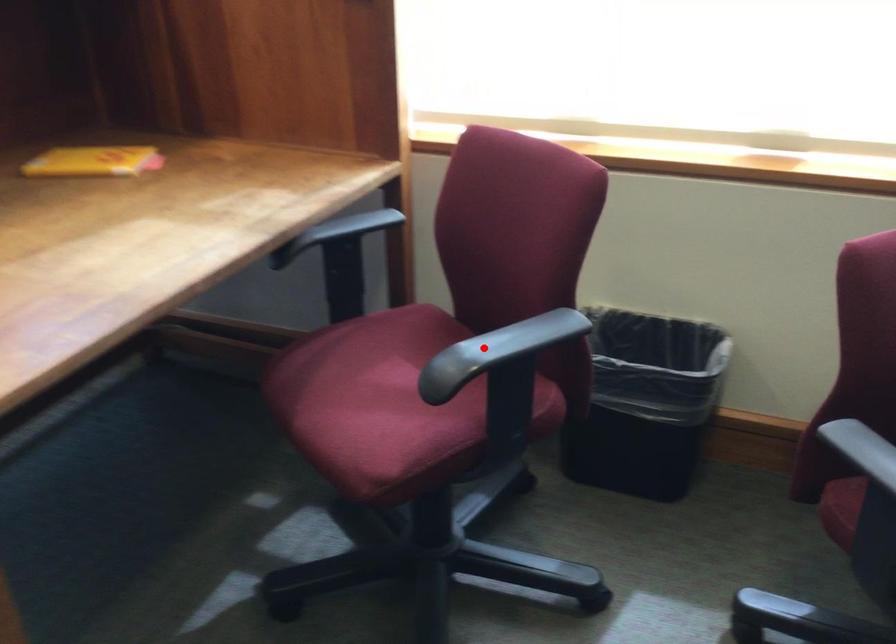
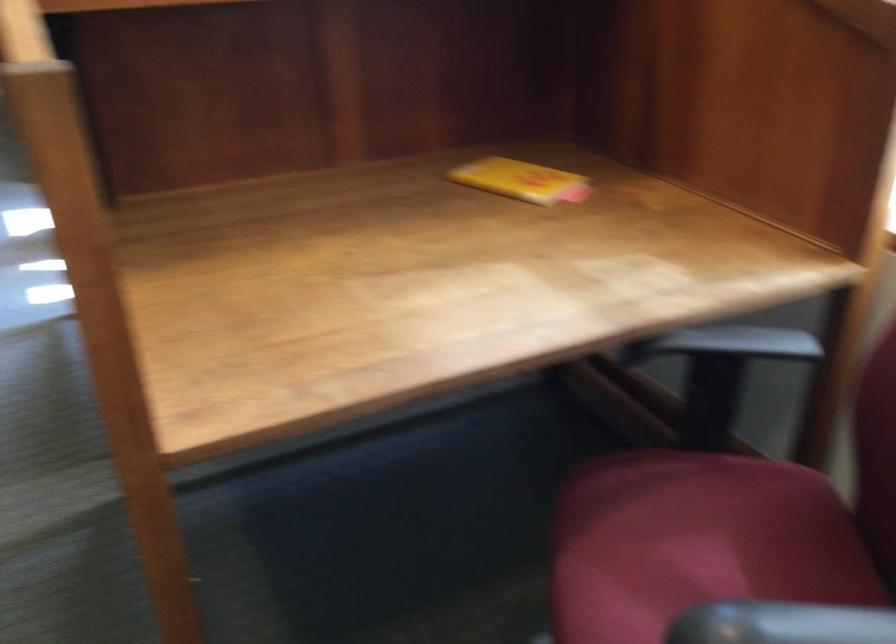
Where in the second image is the point corresponding to the highlighted location from the first image?

(780, 623)